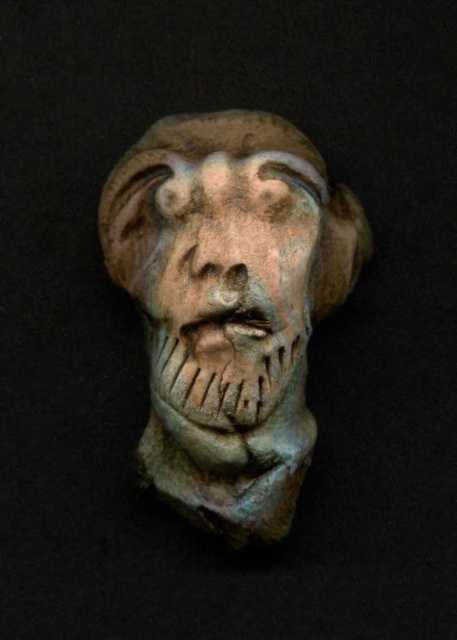
Between matte clay mask at center and matte clay face at center, which one is positioned lower?

matte clay mask at center

Is matte clay mask at center in front of matte clay face at center?

No, it is not.

At what (x,y) coordinates should I click in order to perform the action: click on matte clay mask at center. Please return your answer as a coordinate pair (x, y). Image resolution: width=457 pixels, height=640 pixels. Looking at the image, I should click on (229, 308).

Who is positioned more to the left, matte clay mask at center or matte clay nose at center?

Positioned to the left is matte clay nose at center.

How much distance is there between matte clay mask at center and matte clay nose at center?

4.69 inches

Is point (164, 170) behind point (237, 227)?

Yes, point (164, 170) is behind point (237, 227).

Identify the location of matte clay mask at center. The height and width of the screenshot is (640, 457). (229, 308).

Is matte clay face at center to the left of matte clay nose at center from the viewer's perspective?

No, matte clay face at center is not to the left of matte clay nose at center.

Is matte clay face at center to the right of matte clay nose at center from the viewer's perspective?

Indeed, matte clay face at center is positioned on the right side of matte clay nose at center.

Who is more distant from viewer, (249,184) or (192,227)?

The point (192,227) is more distant.

At what (x,y) coordinates should I click in order to perform the action: click on matte clay face at center. Please return your answer as a coordinate pair (x, y). The height and width of the screenshot is (640, 457). Looking at the image, I should click on (232, 284).